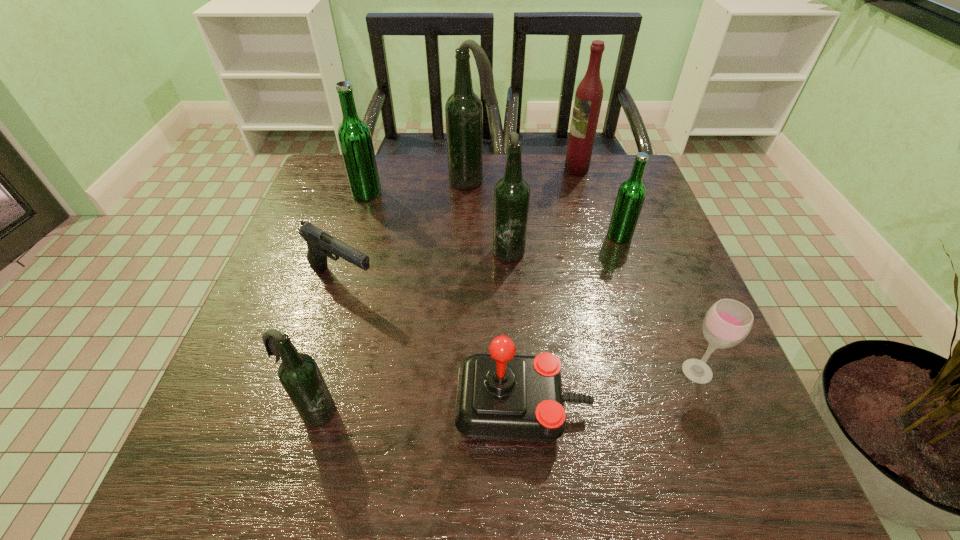
Where is `dark beer bottle that stands as the closest to the farther green beer bottle`? dark beer bottle that stands as the closest to the farther green beer bottle is located at coordinates (463, 111).

Choose which dark beer bottle is the nearest neighbor to the red joystick. Please provide its 2D coordinates. Your answer should be formatted as a tuple, i.e. [(x, y)], where the tuple contains the x and y coordinates of a point satisfying the conditions above.

[(299, 374)]

Find the location of `vacant space that satisfies the following two spatial constraints: 1. at the muzzle of the gun; 2. on the right side of the red joystick`. vacant space that satisfies the following two spatial constraints: 1. at the muzzle of the gun; 2. on the right side of the red joystick is located at coordinates (304, 407).

Find the location of a particular element. The height and width of the screenshot is (540, 960). vacant position in the image that satisfies the following two spatial constraints: 1. on the back side of the nearest beer bottle; 2. on the left side of the wineglass is located at coordinates (325, 371).